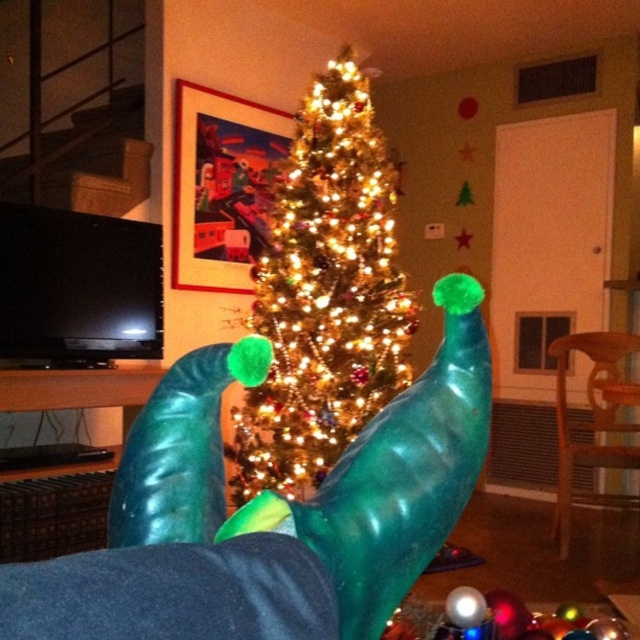
You are a guest at a Christmas party and see the green rubber socks at center and the iridescent shiny tree at center. Which object is larger in size?

The iridescent shiny tree at center is larger in size compared to the green rubber socks at center.

You are a guest at a Christmas party and see the green rubber socks at center and the iridescent shiny tree at center. Which object is closer to you?

The green rubber socks at center is closer to you because it is in front of the iridescent shiny tree at center.

What is the position of the point at coordinates (269, 515) in the image?

The point at coordinates (269, 515) is located on the green rubber socks at center.